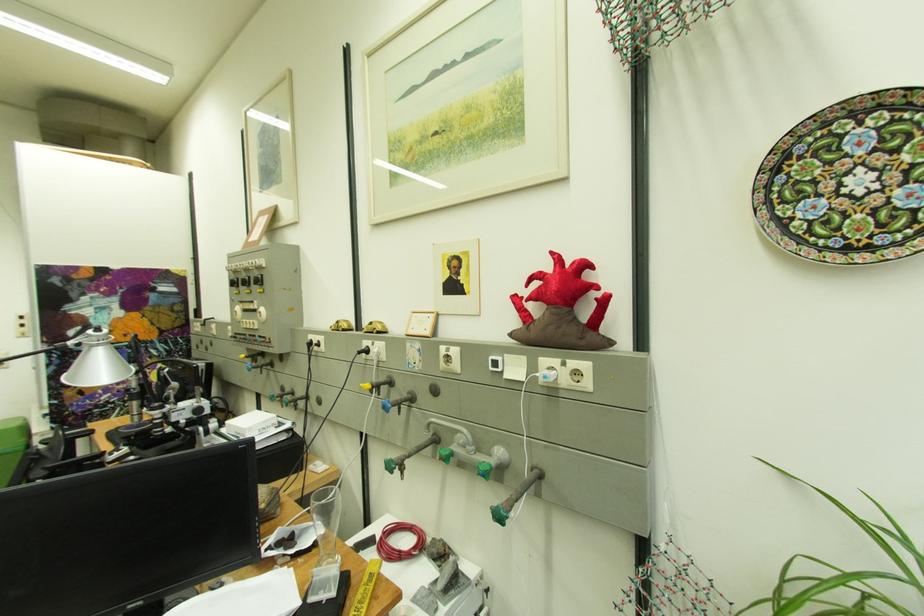
At what (x,y) coordinates should I click in order to perform the action: click on red plush toy. Please return your answer as a coordinate pair (x, y). Image resolution: width=924 pixels, height=616 pixels. Looking at the image, I should click on (562, 309).